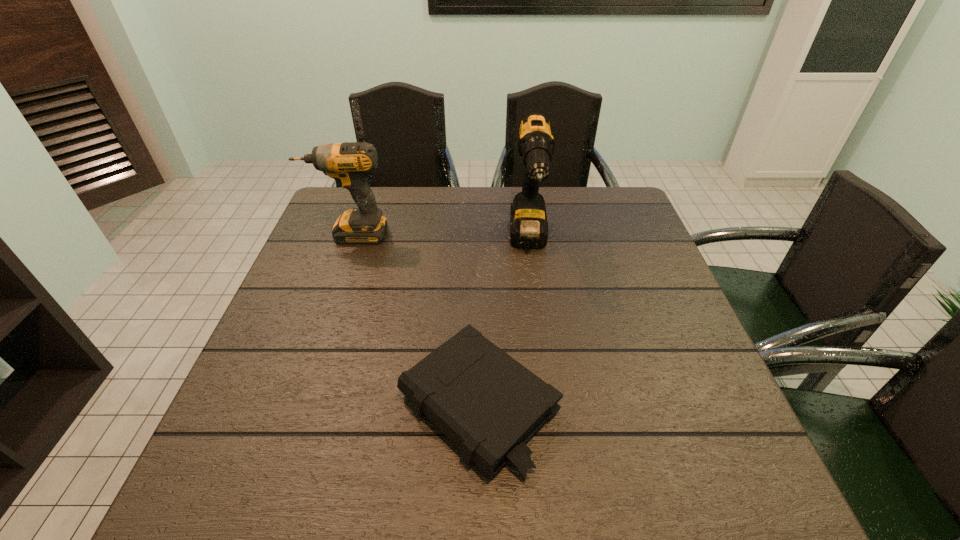
Locate an element on the screen. the right drill is located at coordinates (528, 220).

Where is `the left drill`? The height and width of the screenshot is (540, 960). the left drill is located at coordinates (348, 164).

Where is `the leftmost object`? the leftmost object is located at coordinates (348, 164).

What are the coordinates of `Bible` in the screenshot? It's located at (489, 405).

This screenshot has height=540, width=960. What are the coordinates of `the nearest object` in the screenshot? It's located at (489, 405).

Locate an element on the screen. Image resolution: width=960 pixels, height=540 pixels. vacant space situated at the tip of the right drill is located at coordinates (545, 370).

Find the location of a particular element. The height and width of the screenshot is (540, 960). vacant space located 0.180m on the back of the nearest object is located at coordinates (479, 287).

Locate an element on the screen. This screenshot has width=960, height=540. object present at the near edge is located at coordinates (489, 405).

Identify the location of object at the left edge. (348, 164).

This screenshot has height=540, width=960. I want to click on object located at the far left corner, so pos(348,164).